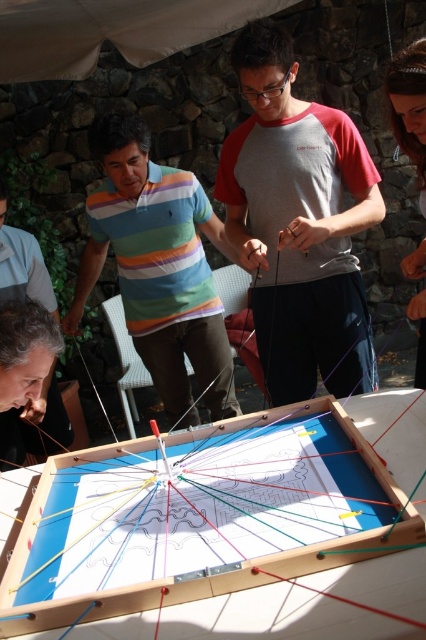
Question: Can you confirm if gray/red cotton shirt at center is bigger than striped cotton shirt at lower left?

Choices:
 (A) no
 (B) yes

Answer: (B)

Question: From the image, what is the correct spatial relationship of gray/red cotton shirt at center in relation to striped cotton shirt at center?

Choices:
 (A) above
 (B) below

Answer: (A)

Question: Is gray/red cotton shirt at center above striped cotton shirt at lower left?

Choices:
 (A) no
 (B) yes

Answer: (B)

Question: Which object is farther from the camera taking this photo?

Choices:
 (A) gray/red cotton shirt at center
 (B) striped cotton shirt at center

Answer: (B)

Question: Which object appears farthest from the camera in this image?

Choices:
 (A) striped cotton shirt at center
 (B) striped cotton shirt at lower left
 (C) gray/red cotton shirt at center

Answer: (A)

Question: Which of the following is the closest to the observer?

Choices:
 (A) tap(339, 300)
 (B) tap(207, 221)

Answer: (A)